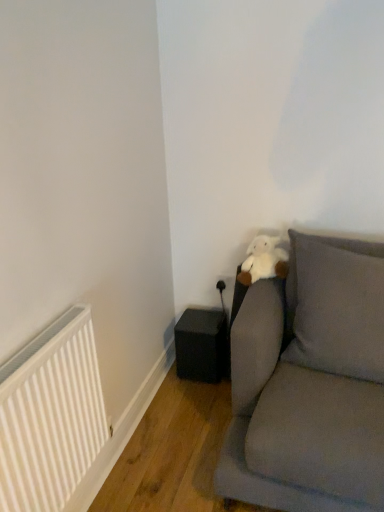
Image resolution: width=384 pixels, height=512 pixels. What do you see at coordinates (51, 416) in the screenshot? I see `white matte radiator at lower left` at bounding box center [51, 416].

This screenshot has height=512, width=384. What do you see at coordinates (310, 384) in the screenshot?
I see `velvet gray couch at right` at bounding box center [310, 384].

Locate an element on the screen. white matte radiator at lower left is located at coordinates (51, 416).

Could you tell me if white matte radiator at lower left is facing white plush at upper right?

No.

Who is taller, white matte radiator at lower left or white plush at upper right?

With more height is white matte radiator at lower left.

From the image's perspective, which object appears higher, white matte radiator at lower left or white plush at upper right?

white plush at upper right, from the image's perspective.

From the picture: Considering the relative sizes of black matte speaker at lower left and velvet gray couch at right in the image provided, is black matte speaker at lower left thinner than velvet gray couch at right?

Correct, the width of black matte speaker at lower left is less than that of velvet gray couch at right.

How different are the orientations of black matte speaker at lower left and velvet gray couch at right in degrees?

There is a 5.34-degree angle between the facing directions of black matte speaker at lower left and velvet gray couch at right.

From a real-world perspective, relative to velvet gray couch at right, is black matte speaker at lower left vertically above or below?

From a real-world perspective, black matte speaker at lower left is physically below velvet gray couch at right.

Where is `studio couch above the black matte speaker at lower left (from a real-world perspective)`? studio couch above the black matte speaker at lower left (from a real-world perspective) is located at coordinates (310, 384).

Considering the sizes of objects white plush at upper right and velvet gray couch at right in the image provided, who is thinner, white plush at upper right or velvet gray couch at right?

With smaller width is white plush at upper right.

Does white plush at upper right turn towards velvet gray couch at right?

Yes.

Is white plush at upper right placed right next to velvet gray couch at right?

No, white plush at upper right is not touching velvet gray couch at right.

Measure the distance between white matte radiator at lower left and velvet gray couch at right.

white matte radiator at lower left is 28.38 inches from velvet gray couch at right.

Is white matte radiator at lower left positioned with its back to velvet gray couch at right?

No, white matte radiator at lower left is not facing away from velvet gray couch at right.

From a real-world perspective, is white matte radiator at lower left under velvet gray couch at right?

No.

Who is more distant, white matte radiator at lower left or velvet gray couch at right?

velvet gray couch at right is more distant.

In terms of size, does gray fabric pillow at upper right appear bigger or smaller than white matte radiator at lower left?

Clearly, gray fabric pillow at upper right is larger in size than white matte radiator at lower left.

Is gray fabric pillow at upper right further to the viewer compared to white matte radiator at lower left?

That is True.

Considering the relative sizes of gray fabric pillow at upper right and white matte radiator at lower left in the image provided, is gray fabric pillow at upper right thinner than white matte radiator at lower left?

Incorrect, the width of gray fabric pillow at upper right is not less than that of white matte radiator at lower left.

Between white plush at upper right and black matte speaker at lower left, which one has larger width?

black matte speaker at lower left is wider.

From a real-world perspective, which is physically below, white plush at upper right or black matte speaker at lower left?

black matte speaker at lower left.

Based on their positions, is white plush at upper right located to the left or right of black matte speaker at lower left?

white plush at upper right is to the right of black matte speaker at lower left.

How many degrees apart are the facing directions of gray fabric pillow at upper right and velvet gray couch at right?

They differ by 0.401 degrees in their facing directions.

Looking at this image, is velvet gray couch at right surrounded by gray fabric pillow at upper right?

No, velvet gray couch at right is not a part of gray fabric pillow at upper right.

From the image's perspective, relative to velvet gray couch at right, is gray fabric pillow at upper right above or below?

From the image's perspective, gray fabric pillow at upper right appears above velvet gray couch at right.

Which object is wider, gray fabric pillow at upper right or velvet gray couch at right?

Wider between the two is velvet gray couch at right.

This screenshot has width=384, height=512. In order to click on teddy above the white matte radiator at lower left (from a real-world perspective) in this screenshot , I will do `click(264, 260)`.

Locate an element on the screen. This screenshot has height=512, width=384. speaker to the left of velvet gray couch at right is located at coordinates (201, 345).

When comparing their distances from white matte radiator at lower left, does black matte speaker at lower left or velvet gray couch at right seem further?

black matte speaker at lower left is further to white matte radiator at lower left.

Which object lies further to the anchor point velvet gray couch at right, black matte speaker at lower left or white matte radiator at lower left?

Among the two, white matte radiator at lower left is located further to velvet gray couch at right.

Based on their spatial positions, is white plush at upper right or white matte radiator at lower left further from gray fabric pillow at upper right?

Among the two, white matte radiator at lower left is located further to gray fabric pillow at upper right.

Looking at the image, which one is located further to white plush at upper right, gray fabric pillow at upper right or white matte radiator at lower left?

Based on the image, white matte radiator at lower left appears to be further to white plush at upper right.

When comparing their distances from black matte speaker at lower left, does white plush at upper right or velvet gray couch at right seem further?

Among the two, velvet gray couch at right is located further to black matte speaker at lower left.

Which object lies further to the anchor point white matte radiator at lower left, velvet gray couch at right or gray fabric pillow at upper right?

gray fabric pillow at upper right lies further to white matte radiator at lower left than the other object.

Looking at the image, which one is located further to velvet gray couch at right, black matte speaker at lower left or white plush at upper right?

black matte speaker at lower left is positioned further to the anchor velvet gray couch at right.

From the picture: Looking at the image, which one is located closer to gray fabric pillow at upper right, black matte speaker at lower left or velvet gray couch at right?

Based on the image, velvet gray couch at right appears to be nearer to gray fabric pillow at upper right.

Locate an element on the screen. This screenshot has height=512, width=384. teddy located between gray fabric pillow at upper right and black matte speaker at lower left in the depth direction is located at coordinates (264, 260).

Where is `pillow located between velvet gray couch at right and white plush at upper right in the depth direction`? This screenshot has width=384, height=512. pillow located between velvet gray couch at right and white plush at upper right in the depth direction is located at coordinates (337, 307).

Find the location of a particular element. This screenshot has height=512, width=384. teddy between white matte radiator at lower left and black matte speaker at lower left along the z-axis is located at coordinates (264, 260).

You are a GUI agent. You are given a task and a screenshot of the screen. Output one action in this format:
    pyautogui.click(x=<x>, y=<y>)
    Task: Click on the pillow located between white matte radiator at lower left and black matte speaker at lower left in the depth direction
    
    Given the screenshot: What is the action you would take?
    click(337, 307)